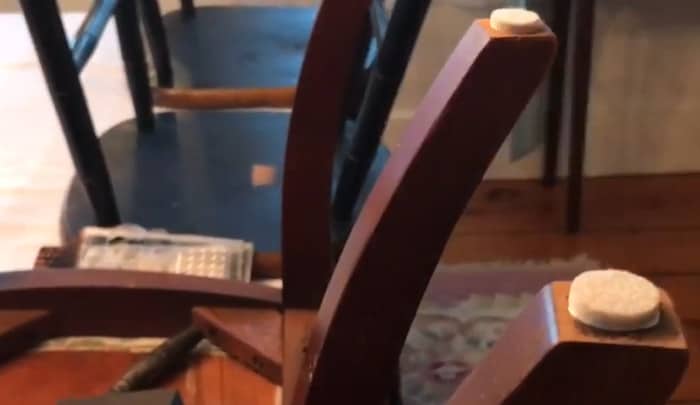
Identify the location of brown chair. (99, 370).